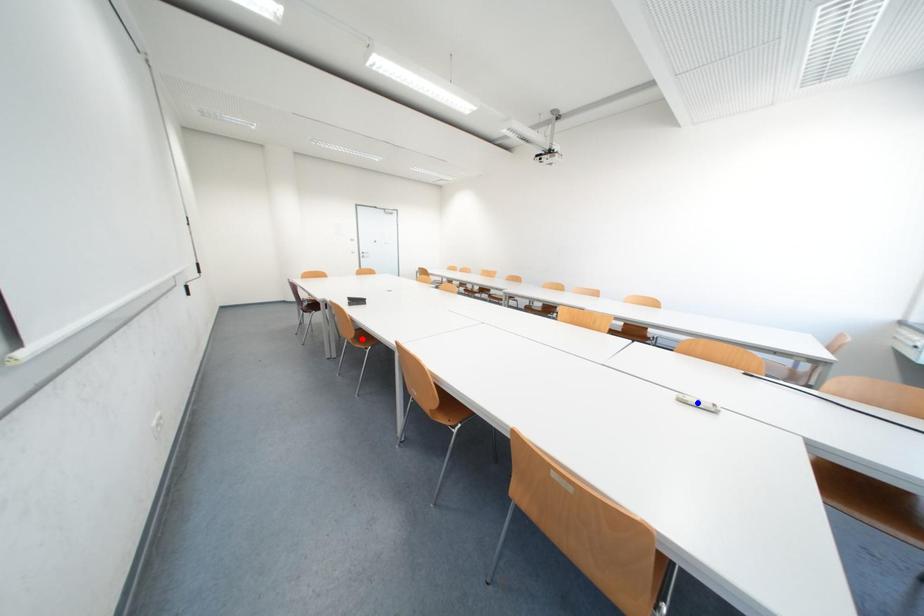
Question: Which of the two points in the image is closer to the camera?

Choices:
 (A) Blue point is closer.
 (B) Red point is closer.

Answer: (A)